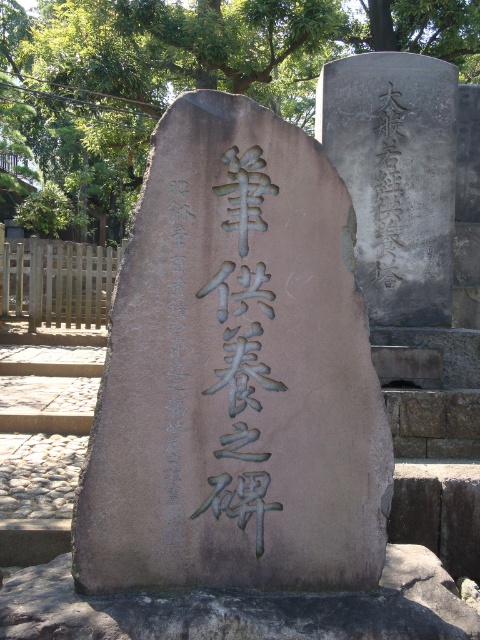
You are standing in front of the brown polished stone monument at center and want to touch the black stone inscription at center. Can you reach it without moving your position?

The brown polished stone monument at center is closer to the viewer than the black stone inscription at center, so you cannot reach it without moving closer.